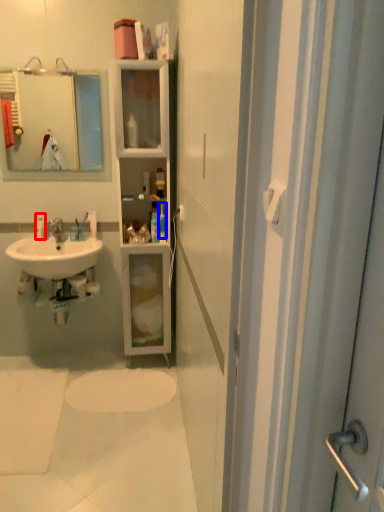
Question: Among these objects, which one is farthest to the camera, toiletry (highlighted by a red box) or toiletry (highlighted by a blue box)?

Choices:
 (A) toiletry
 (B) toiletry

Answer: (A)